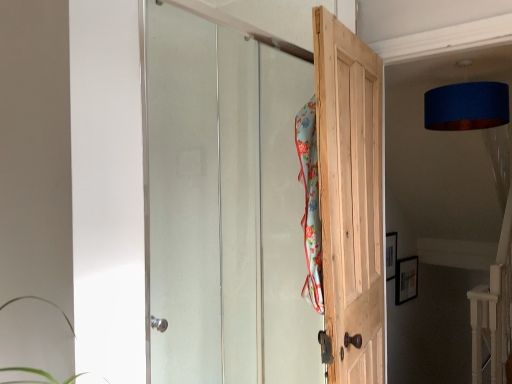
Question: Should I look upward or downward to see clear glass door at upper center, the second door when ordered from right to left?

Choices:
 (A) up
 (B) down

Answer: (B)

Question: Does floral fabric beach towel at center have a greater height compared to blue fabric lampshade at upper right?

Choices:
 (A) yes
 (B) no

Answer: (A)

Question: From a real-world perspective, is floral fabric beach towel at center positioned over blue fabric lampshade at upper right based on gravity?

Choices:
 (A) no
 (B) yes

Answer: (A)

Question: Is floral fabric beach towel at center closer to the viewer compared to blue fabric lampshade at upper right?

Choices:
 (A) yes
 (B) no

Answer: (A)

Question: Is the position of floral fabric beach towel at center more distant than that of blue fabric lampshade at upper right?

Choices:
 (A) no
 (B) yes

Answer: (A)

Question: Can you confirm if floral fabric beach towel at center is positioned to the left of blue fabric lampshade at upper right?

Choices:
 (A) yes
 (B) no

Answer: (A)

Question: From a real-world perspective, does floral fabric beach towel at center sit lower than blue fabric lampshade at upper right?

Choices:
 (A) yes
 (B) no

Answer: (A)

Question: Is blue fabric lampshade at upper right aimed at natural wood door at center, which appears as the 2th door when viewed from the left?

Choices:
 (A) yes
 (B) no

Answer: (B)

Question: From the image's perspective, is blue fabric lampshade at upper right above natural wood door at center, which appears as the 2th door when viewed from the left?

Choices:
 (A) no
 (B) yes

Answer: (B)

Question: From a real-world perspective, is blue fabric lampshade at upper right physically above natural wood door at center, arranged as the first door when viewed from the right?

Choices:
 (A) no
 (B) yes

Answer: (B)

Question: From the image's perspective, does blue fabric lampshade at upper right appear lower than natural wood door at center, arranged as the first door when viewed from the right?

Choices:
 (A) no
 (B) yes

Answer: (A)

Question: Is blue fabric lampshade at upper right bigger than natural wood door at center, which appears as the 2th door when viewed from the left?

Choices:
 (A) no
 (B) yes

Answer: (A)

Question: Is blue fabric lampshade at upper right positioned far away from natural wood door at center, which appears as the 2th door when viewed from the left?

Choices:
 (A) yes
 (B) no

Answer: (B)

Question: Considering the relative positions of clear glass door at upper center, the second door when ordered from right to left, and natural wood door at center, which appears as the 2th door when viewed from the left, in the image provided, is clear glass door at upper center, the second door when ordered from right to left, to the right of natural wood door at center, which appears as the 2th door when viewed from the left, from the viewer's perspective?

Choices:
 (A) no
 (B) yes

Answer: (A)